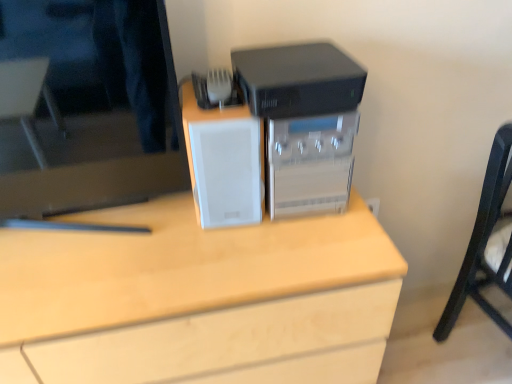
Question: From the image's perspective, is white matte desk at center beneath white matte speaker at center?

Choices:
 (A) no
 (B) yes

Answer: (B)

Question: Is white matte desk at center thinner than white matte speaker at center?

Choices:
 (A) no
 (B) yes

Answer: (A)

Question: Is white matte desk at center completely or partially outside of white matte speaker at center?

Choices:
 (A) yes
 (B) no

Answer: (A)

Question: Does white matte desk at center have a larger size compared to white matte speaker at center?

Choices:
 (A) yes
 (B) no

Answer: (A)

Question: From a real-world perspective, is white matte desk at center below white matte speaker at center?

Choices:
 (A) yes
 (B) no

Answer: (A)

Question: Visually, is matte black monitor at upper left positioned to the left or to the right of white matte desk at center?

Choices:
 (A) left
 (B) right

Answer: (A)

Question: In the image, is matte black monitor at upper left positioned in front of or behind white matte desk at center?

Choices:
 (A) front
 (B) behind

Answer: (A)

Question: From the image's perspective, is matte black monitor at upper left above or below white matte desk at center?

Choices:
 (A) above
 (B) below

Answer: (A)

Question: From a real-world perspective, is matte black monitor at upper left positioned above or below white matte desk at center?

Choices:
 (A) above
 (B) below

Answer: (A)

Question: From the image's perspective, relative to sleek plastic printer at center, is matte black monitor at upper left above or below?

Choices:
 (A) below
 (B) above

Answer: (B)

Question: Which is correct: matte black monitor at upper left is inside sleek plastic printer at center, or outside of it?

Choices:
 (A) outside
 (B) inside

Answer: (A)

Question: From their relative heights in the image, would you say matte black monitor at upper left is taller or shorter than sleek plastic printer at center?

Choices:
 (A) tall
 (B) short

Answer: (A)

Question: Is point (160, 39) positioned closer to the camera than point (314, 183)?

Choices:
 (A) closer
 (B) farther

Answer: (A)

Question: Would you say sleek plastic printer at center is inside or outside matte black monitor at upper left?

Choices:
 (A) outside
 (B) inside

Answer: (A)

Question: From the image's perspective, is sleek plastic printer at center above or below matte black monitor at upper left?

Choices:
 (A) above
 (B) below

Answer: (B)